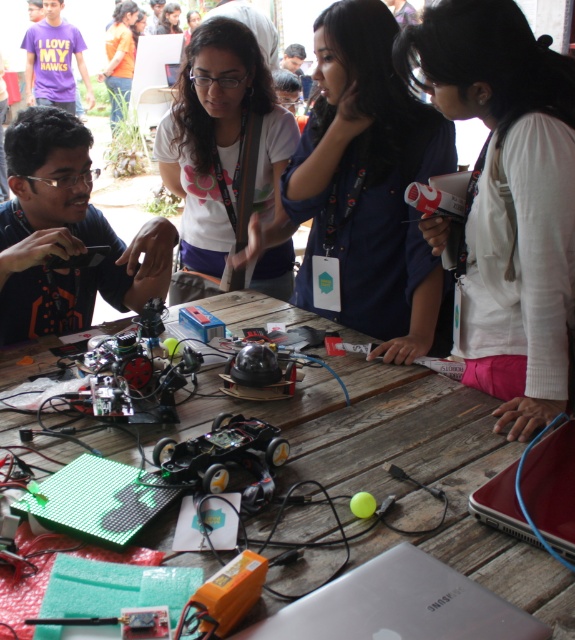
You are a photographer at the event and want to ensure both the matte white shirt at center and the purple cotton shirt at upper left are visible in your photo. Considering their sizes, which shirt might you need to position closer to the camera to ensure it doesn

The matte white shirt at center is smaller than the purple cotton shirt at upper left. To ensure both are visible, you may need to position the matte white shirt at center closer to the camera since it is smaller and might appear less prominent if farther away.

You are a participant at this event and need to place a 1.2 meter wide project display on the wooden table at center. Considering the purple cotton shirt at upper left is currently occupying space on the table, can the display fit on the table?

The wooden table at center is wider than the purple cotton shirt at upper left. However, the description only states the table is wider than the shirt, but does not provide exact measurements. Without knowing the actual width of the table, it is impossible to determine if the 1.2 meter wide display will fit. Please check the table dimensions before placing the display.

You are a participant at the robotics event and want to locate the exact position of the point with coordinates (228,154) on the table. Based on the scene description, where would this point be located?

The point with coordinates (228,154) is located on the matte white shirt at center.